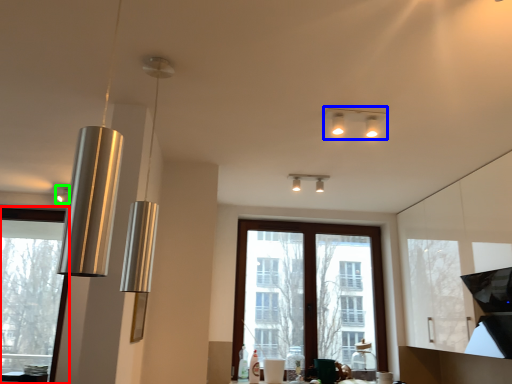
Question: Estimate the real-world distances between objects in this image. Which object is farther from window (highlighted by a red box), lamp (highlighted by a blue box) or lamp (highlighted by a green box)?

Choices:
 (A) lamp
 (B) lamp

Answer: (A)